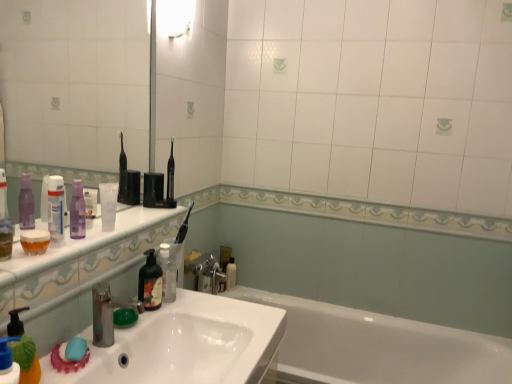
This screenshot has height=384, width=512. In order to click on unoccupied region to the right of translucent floral-patterned mouthwash at sink left, which is the second mouthwash from top to bottom in this screenshot , I will do click(x=202, y=307).